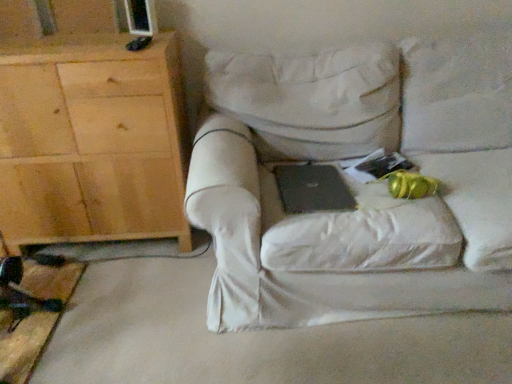
The height and width of the screenshot is (384, 512). What do you see at coordinates (357, 183) in the screenshot?
I see `white fabric chair at center` at bounding box center [357, 183].

You are a GUI agent. You are given a task and a screenshot of the screen. Output one action in this format:
    pyautogui.click(x=<x>, y=<y>)
    Task: Click on the black matte laptop at center
    Image resolution: width=512 pixels, height=384 pixels.
    Given the screenshot: What is the action you would take?
    pyautogui.click(x=312, y=189)

Find the location of `white fabric chair at center`. white fabric chair at center is located at coordinates (357, 183).

Is light wood cabinet at left at the left side of white fabric chair at center?

Yes, light wood cabinet at left is to the left of white fabric chair at center.

Does light wood cabinet at left turn towards white fabric chair at center?

No, light wood cabinet at left is not aimed at white fabric chair at center.

Considering the relative sizes of light wood cabinet at left and white fabric chair at center in the image provided, is light wood cabinet at left taller than white fabric chair at center?

Indeed, light wood cabinet at left has a greater height compared to white fabric chair at center.

From the image's perspective, between light wood cabinet at left and white fabric chair at center, which one is located above?

light wood cabinet at left, from the image's perspective.

Between light wood cabinet at left and black matte laptop at center, which one has larger size?

With larger size is light wood cabinet at left.

Is light wood cabinet at left next to black matte laptop at center and touching it?

No, light wood cabinet at left is not next to black matte laptop at center.

Is light wood cabinet at left not within black matte laptop at center?

Yes.

From a real-world perspective, is white fabric chair at center above or below light wood cabinet at left?

Clearly, from a real-world perspective, white fabric chair at center is below light wood cabinet at left.

Is white fabric chair at center facing towards light wood cabinet at left?

No.

Which is further, [196,199] or [26,216]?

Positioned behind is point [26,216].

Which is more to the left, white fabric chair at center or black matte laptop at center?

black matte laptop at center.

At what (x,y) coordinates should I click in order to perform the action: click on laptop below the white fabric chair at center (from the image's perspective). Please return your answer as a coordinate pair (x, y). Looking at the image, I should click on click(312, 189).

Is white fabric chair at center smaller than black matte laptop at center?

Actually, white fabric chair at center might be larger than black matte laptop at center.

Consider the image. From the image's perspective, which one is positioned higher, white fabric chair at center or black matte laptop at center?

From the image's view, white fabric chair at center is above.

Does black matte laptop at center lie in front of light wood cabinet at left?

Yes, black matte laptop at center is closer to the camera.

Does black matte laptop at center have a lesser width compared to light wood cabinet at left?

Correct, the width of black matte laptop at center is less than that of light wood cabinet at left.

In the scene shown: Is light wood cabinet at left at the back of black matte laptop at center?

No.

From the image's perspective, does black matte laptop at center appear lower than light wood cabinet at left?

Correct, black matte laptop at center appears lower than light wood cabinet at left in the image.

Is black matte laptop at center completely or partially outside of white fabric chair at center?

No, black matte laptop at center is not outside of white fabric chair at center.

From a real-world perspective, between black matte laptop at center and white fabric chair at center, who is vertically higher?

From a 3D spatial view, white fabric chair at center is above.

Which object is thinner, black matte laptop at center or white fabric chair at center?

Thinner between the two is black matte laptop at center.

Is white fabric chair at center at the back of black matte laptop at center?

Correct, black matte laptop at center is looking away from white fabric chair at center.

This screenshot has width=512, height=384. I want to click on chair on the right of light wood cabinet at left, so click(x=357, y=183).

Where is `laptop below the light wood cabinet at left (from the image's perspective)`? The image size is (512, 384). laptop below the light wood cabinet at left (from the image's perspective) is located at coordinates (312, 189).

Considering their positions, is white fabric chair at center positioned closer to light wood cabinet at left than black matte laptop at center?

white fabric chair at center lies closer to light wood cabinet at left than the other object.

Based on their spatial positions, is black matte laptop at center or white fabric chair at center further from light wood cabinet at left?

Among the two, black matte laptop at center is located further to light wood cabinet at left.

When comparing their distances from white fabric chair at center, does black matte laptop at center or light wood cabinet at left seem closer?

black matte laptop at center is positioned closer to the anchor white fabric chair at center.

When comparing their distances from black matte laptop at center, does light wood cabinet at left or white fabric chair at center seem closer?

white fabric chair at center is closer to black matte laptop at center.

Based on their spatial positions, is light wood cabinet at left or black matte laptop at center closer to white fabric chair at center?

black matte laptop at center lies closer to white fabric chair at center than the other object.

Based on the photo, when comparing their distances from black matte laptop at center, does white fabric chair at center or light wood cabinet at left seem further?

light wood cabinet at left lies further to black matte laptop at center than the other object.

Identify the location of laptop between light wood cabinet at left and white fabric chair at center in the horizontal direction. The height and width of the screenshot is (384, 512). (312, 189).